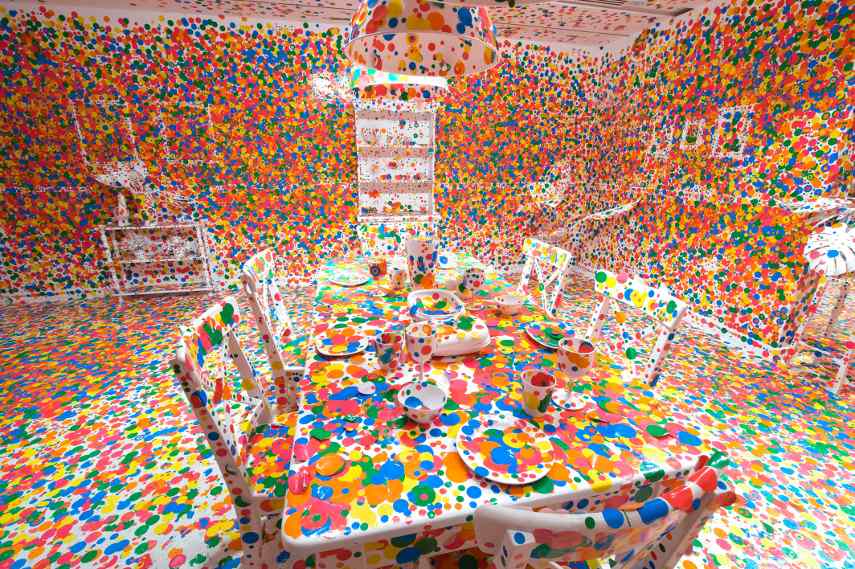
I want to click on plate, so click(x=509, y=477).